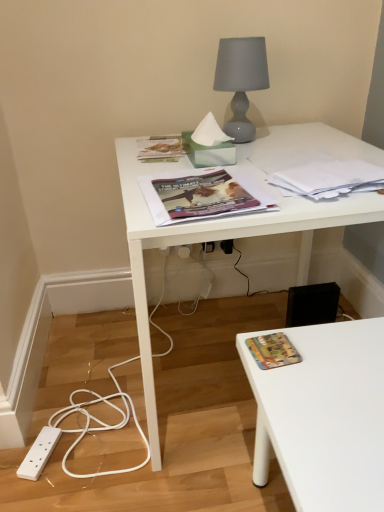
Question: From the image's perspective, is white plastic power plugs and sockets at lower left located above or below white plastic electric outlet at lower center, which is the first electric outlet in left-to-right order?

Choices:
 (A) above
 (B) below

Answer: (B)

Question: Based on their sizes in the image, would you say white plastic power plugs and sockets at lower left is bigger or smaller than white plastic electric outlet at lower center, which is the first electric outlet in left-to-right order?

Choices:
 (A) small
 (B) big

Answer: (B)

Question: Based on their relative distances, which object is farther from the matte magazine at center, the 2th book cover ordered from the bottom?

Choices:
 (A) multicolored fabric book at lower right, the second book cover from the top
 (B) white plastic electric outlet at lower center, which is the first electric outlet in left-to-right order
 (C) white plastic power plugs and sockets at lower left
 (D) white glossy desk at upper center
 (E) matte green paperback book at upper center, acting as the second paperback book starting from the bottom

Answer: (C)

Question: Estimate the real-world distances between objects in this image. Which object is farther from the matte green paperback book at upper center, the 2th paperback book viewed from the front?

Choices:
 (A) matte magazine at center, the 2th book cover ordered from the bottom
 (B) multicolored fabric book at lower right, which appears as the 1th book cover when ordered from the bottom
 (C) white plastic electric outlet at lower center, which is the first electric outlet in left-to-right order
 (D) matte gray glass lamp at upper center
 (E) black plastic electric outlet at lower center, which is the 1th electric outlet in right-to-left order

Answer: (B)